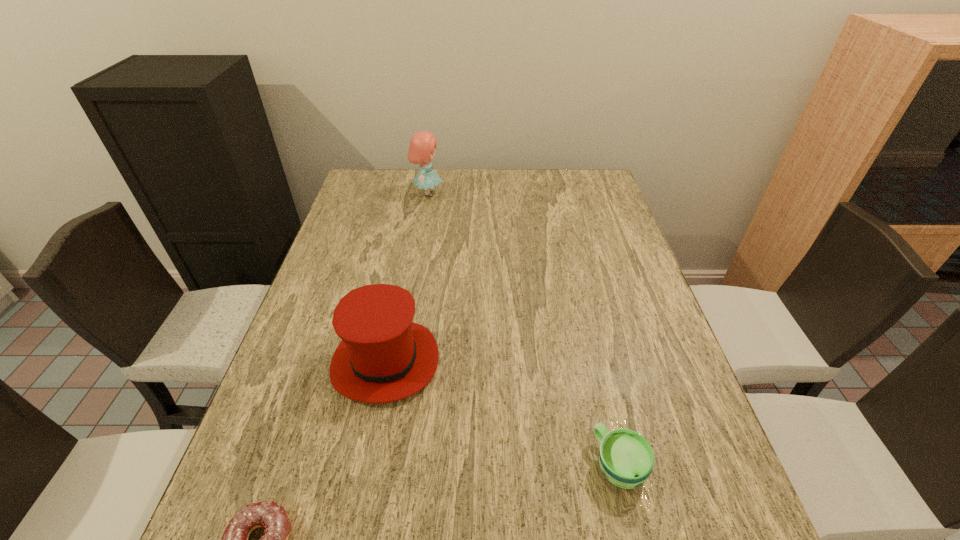
In order to click on vacant region between the tallest object and the third farthest object in this screenshot , I will do `click(523, 329)`.

Locate which object ranks third in proximity to the rightmost object. Please provide its 2D coordinates. Your answer should be formatted as a tuple, i.e. [(x, y)], where the tuple contains the x and y coordinates of a point satisfying the conditions above.

[(421, 150)]

Identify which object is the second closest to the nearest object. Please provide its 2D coordinates. Your answer should be formatted as a tuple, i.e. [(x, y)], where the tuple contains the x and y coordinates of a point satisfying the conditions above.

[(626, 458)]

Image resolution: width=960 pixels, height=540 pixels. Identify the location of free space that satisfies the following two spatial constraints: 1. on the front-facing side of the third farthest object; 2. on the left side of the tallest object. (383, 465).

At what (x,y) coordinates should I click in order to perform the action: click on free space that satisfies the following two spatial constraints: 1. on the front side of the rightmost object; 2. on the left side of the third shortest object. Please return your answer as a coordinate pair (x, y). The image size is (960, 540). Looking at the image, I should click on (365, 465).

This screenshot has width=960, height=540. In order to click on vacant space that satisfies the following two spatial constraints: 1. on the front-facing side of the tallest object; 2. on the front side of the third nearest object in this screenshot , I will do `click(399, 362)`.

Locate an element on the screen. free location that satisfies the following two spatial constraints: 1. on the back side of the rightmost object; 2. on the front-facing side of the farthest object is located at coordinates (555, 194).